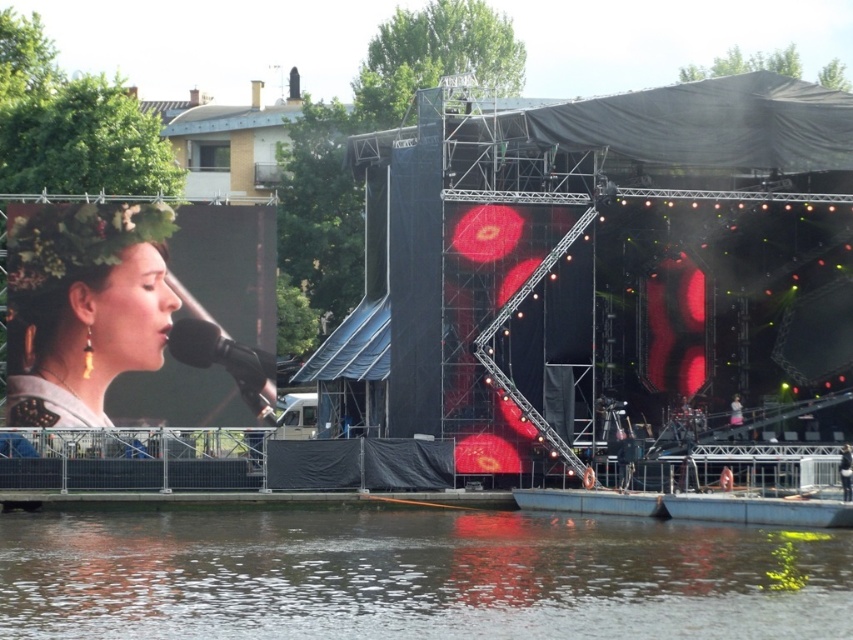
Looking at this image, can you confirm if matte floral crown at left is smaller than black matte microphone at center?

Actually, matte floral crown at left might be larger than black matte microphone at center.

Is matte floral crown at left further to camera compared to black matte microphone at center?

No, it is not.

The width and height of the screenshot is (853, 640). Find the location of `matte floral crown at left`. matte floral crown at left is located at coordinates (83, 307).

Is smooth water at lower center thinner than matte floral crown at left?

Incorrect, smooth water at lower center's width is not less than matte floral crown at left's.

Is smooth water at lower center below matte floral crown at left?

Yes, smooth water at lower center is below matte floral crown at left.

Which is in front, point (148, 604) or point (111, 284)?

Point (148, 604)

Locate an element on the screen. The image size is (853, 640). smooth water at lower center is located at coordinates (415, 577).

Is smooth water at lower center in front of black matte microphone at center?

Yes, smooth water at lower center is in front of black matte microphone at center.

Can you confirm if smooth water at lower center is smaller than black matte microphone at center?

No.

Is point (395, 573) positioned before point (263, 387)?

Yes.

You are a GUI agent. You are given a task and a screenshot of the screen. Output one action in this format:
    pyautogui.click(x=<x>, y=<y>)
    Task: Click on the smooth water at lower center
    This screenshot has width=853, height=640.
    Given the screenshot: What is the action you would take?
    pyautogui.click(x=415, y=577)